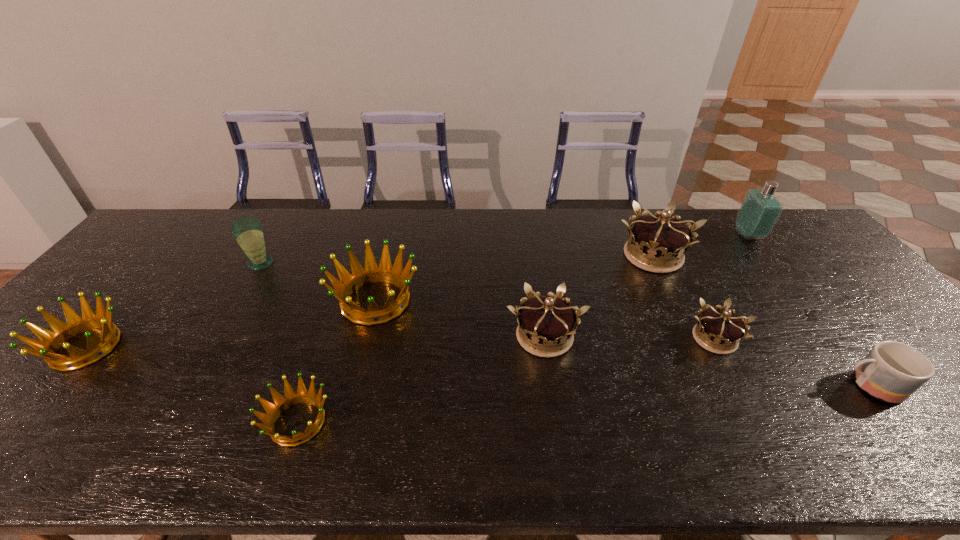
The height and width of the screenshot is (540, 960). Identify the location of free region located on the front of the biggest golden crown. (361, 359).

At what (x,y) coordinates should I click in order to perform the action: click on free region located on the left of the smallest gold crown. Please return your answer as a coordinate pair (x, y). Looking at the image, I should click on tap(557, 339).

I want to click on free point located on the back of the second smallest golden crown, so click(127, 300).

You are a GUI agent. You are given a task and a screenshot of the screen. Output one action in this format:
    pyautogui.click(x=<x>, y=<y>)
    Task: Click on the free spot located 0.120m on the side with the handle of the mug
    
    Given the screenshot: What is the action you would take?
    pyautogui.click(x=786, y=386)

What are the coordinates of `free space located on the side with the handle of the mug` in the screenshot? It's located at (778, 386).

Identify the location of vacant space positioned on the side with the handle of the mug. The height and width of the screenshot is (540, 960). (727, 386).

The image size is (960, 540). In order to click on vacant space located 0.150m on the left of the nearest crown in this screenshot , I will do `click(194, 422)`.

This screenshot has height=540, width=960. Identify the location of perfume that is positioned at the far edge. (760, 209).

The width and height of the screenshot is (960, 540). Find the location of `crown located in the far edge section of the desktop`. crown located in the far edge section of the desktop is located at coordinates (657, 243).

You are a GUI agent. You are given a task and a screenshot of the screen. Output one action in this format:
    pyautogui.click(x=<x>, y=<y>)
    Task: Click on the object that is at the near edge
    The height and width of the screenshot is (540, 960).
    Given the screenshot: What is the action you would take?
    pyautogui.click(x=281, y=403)